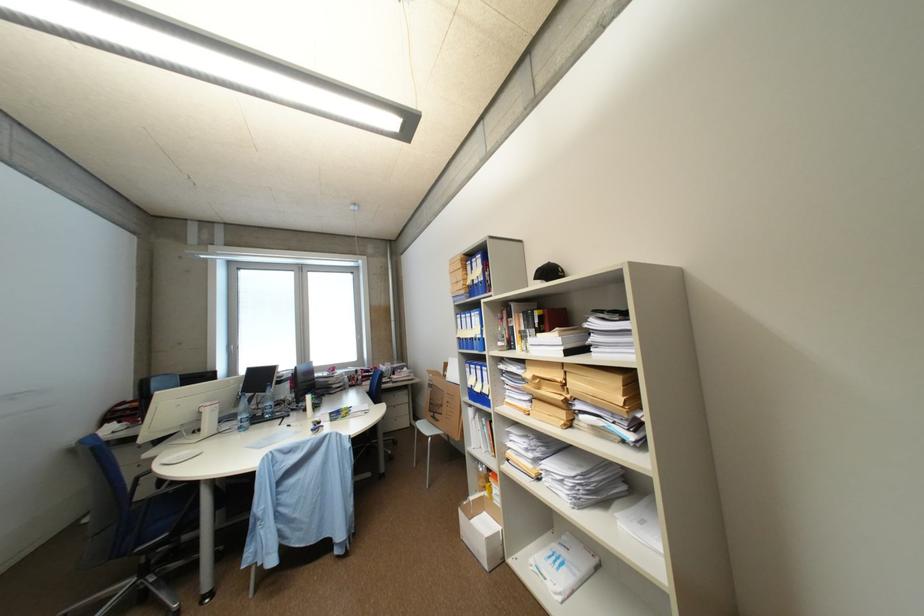
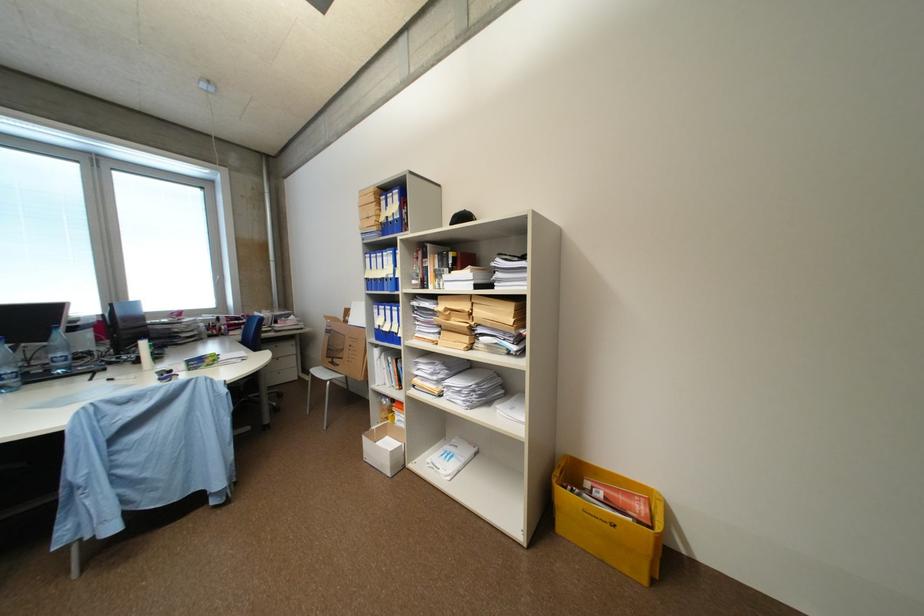
Find the pixel in the second image that matches (x=439, y=405) in the first image.

(336, 350)